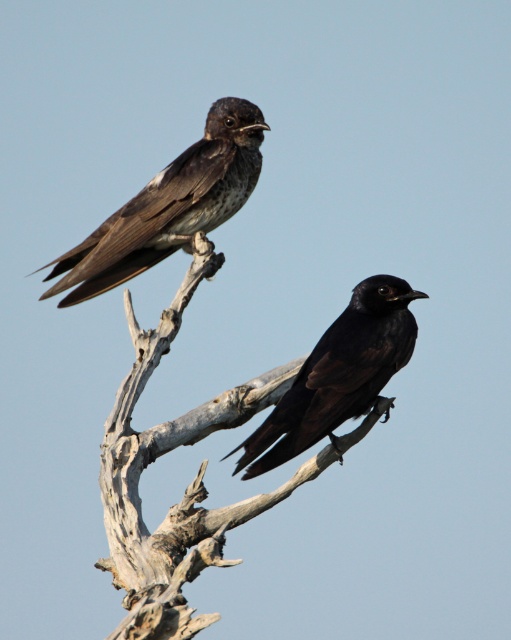
You are standing in front of a tree with two birds on a branch. You see a point labeled point (191, 413) and another point labeled point (134, 272). Which point is nearer to you?

Point (191, 413) is closer to the viewer than point (134, 272).

You are a birdwatcher observing the scene. You notice the shiny black bird at center and the brown wood branch at upper center. Which object is positioned higher in the image?

The shiny black bird at center is positioned higher than the brown wood branch at upper center because the branch is located below the bird.

You are a birdwatcher trying to identify the birds in the image. You notice the shiny black bird at center is perched on the brown wood branch at upper center. Can you determine if the branch is wider than the bird?

The brown wood branch at upper center is wider than the shiny black bird at center, so yes, the branch is wider than the bird.